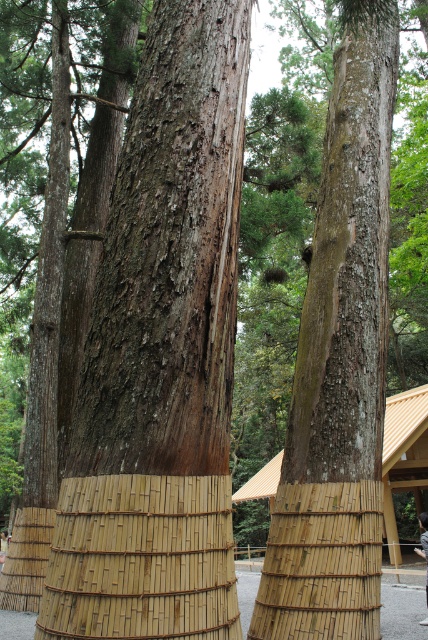
You are an environmental scientist examining the trees in the image. You notice the smooth brown bark at center and the bamboo mat at center. Based on their positions, which object would you say is closer to you?

The smooth brown bark at center is closer to you since it is positioned in front of the bamboo mat at center.

You are a botanist examining the trees in the image. You notice the smooth brown bark at center and the bamboo mat at center. Which of these two items has a greater thickness?

The bamboo mat at center is thicker than the smooth brown bark at center.

Based on the photo, you are a botanist examining two tree trunks in the image. The first is the brown rough bark tree trunk at center, and the second is the smooth brown bark at center. Which of these two trunks has a greater circumference?

The brown rough bark tree trunk at center has a greater circumference than the smooth brown bark at center because it is larger in size.